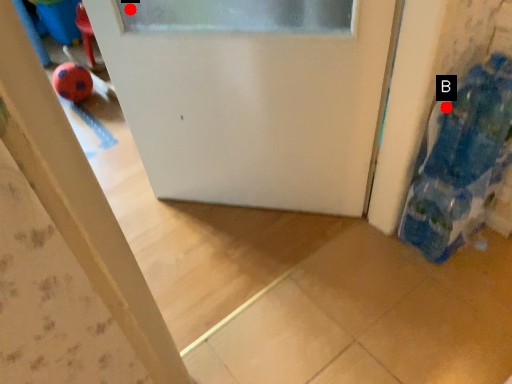
Question: Two points are circled on the image, labeled by A and B beside each circle. Among these points, which one is farthest from the camera?

Choices:
 (A) A is further
 (B) B is further

Answer: (A)